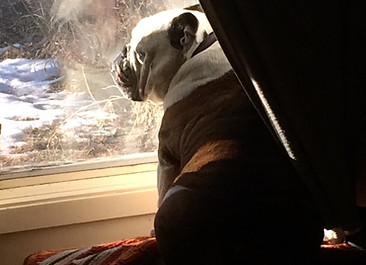
Where is `window sill`? This screenshot has width=366, height=265. window sill is located at coordinates (105, 170).